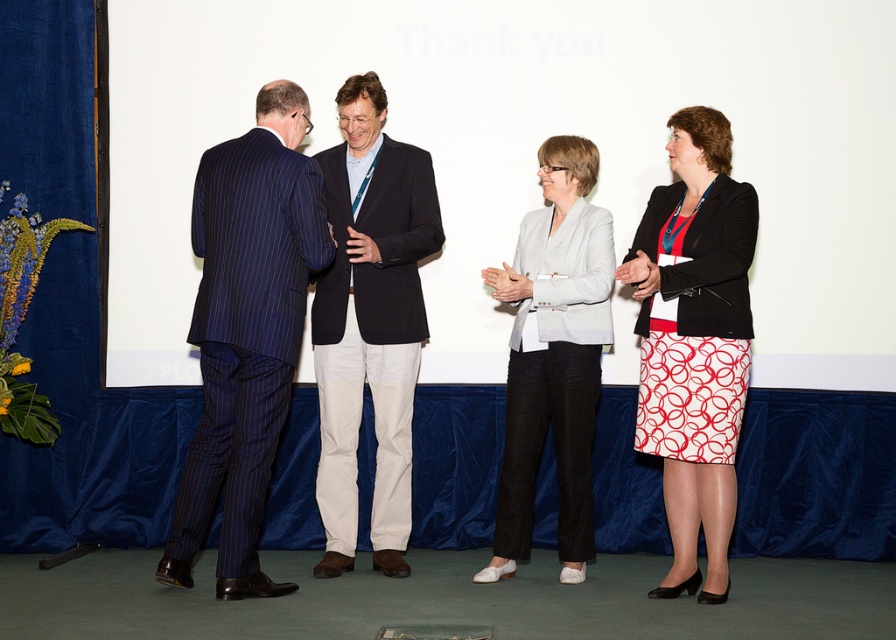
In the scene shown: Between dark blue pinstripe suit at center and light gray blazer at center, which one appears on the left side from the viewer's perspective?

From the viewer's perspective, dark blue pinstripe suit at center appears more on the left side.

Is dark blue pinstripe suit at center closer to the viewer compared to light gray blazer at center?

No.

Identify the location of dark blue pinstripe suit at center. This screenshot has width=896, height=640. (371, 336).

Find the location of a particular element. This screenshot has height=640, width=896. dark blue pinstripe suit at center is located at coordinates (371, 336).

Which is more to the left, white matte screen at upper center or light gray blazer at center?

white matte screen at upper center is more to the left.

Can you confirm if white matte screen at upper center is shorter than light gray blazer at center?

Yes.

Where is `white matte screen at upper center`? Image resolution: width=896 pixels, height=640 pixels. white matte screen at upper center is located at coordinates (528, 150).

Identify the location of white matte screen at upper center. The height and width of the screenshot is (640, 896). (528, 150).

Is white matte screen at upper center below dark blue pinstripe suit at center?

No.

Identify the location of white matte screen at upper center. (528, 150).